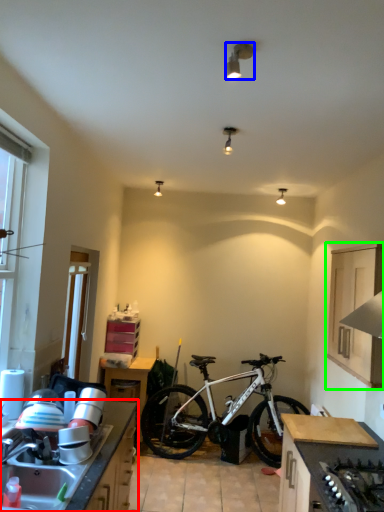
Question: Which object is positioned closest to countertop (highlighted by a red box)? Select from lamp (highlighted by a blue box) and cabinetry (highlighted by a green box).

Choices:
 (A) lamp
 (B) cabinetry

Answer: (B)